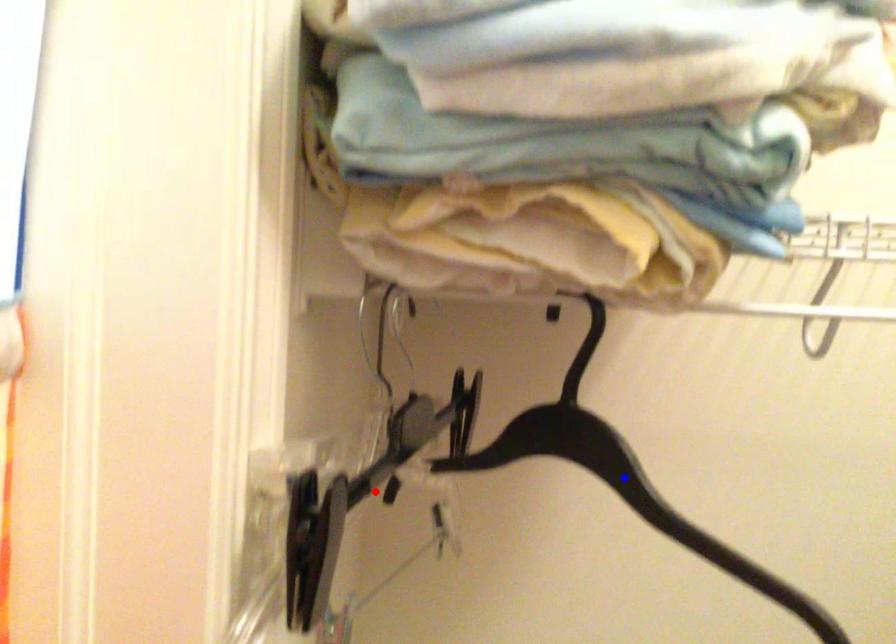
Question: Which of the two points in the image is closer to the camera?

Choices:
 (A) Blue point is closer.
 (B) Red point is closer.

Answer: (A)